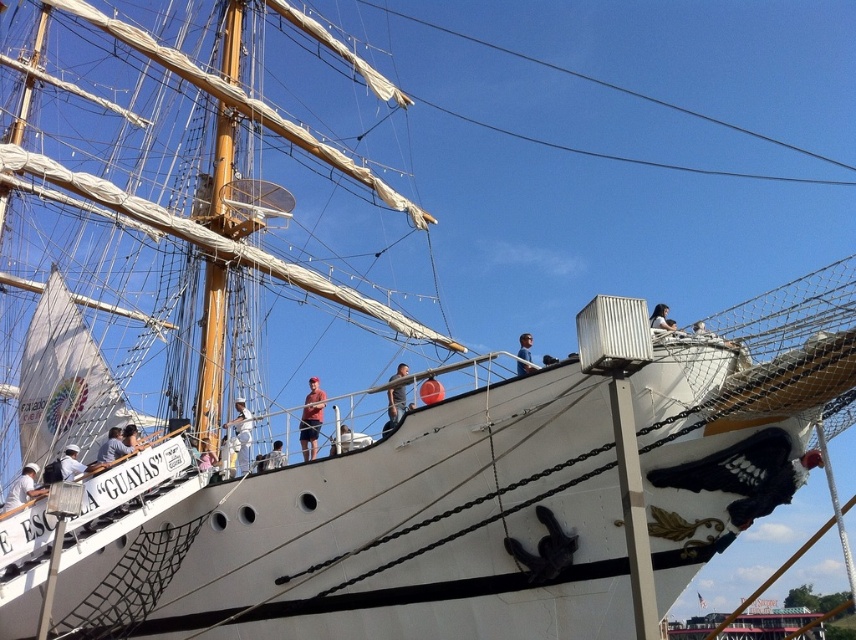
Question: Among these objects, which one is nearest to the camera?

Choices:
 (A) white matte shirt at upper left
 (B) gray fabric shirt at center
 (C) white fabric shirt at center

Answer: (B)

Question: Can you confirm if white matte sailor at lower left is thinner than white matte shirt at upper center?

Choices:
 (A) yes
 (B) no

Answer: (B)

Question: Which point appears farthest from the camera in this image?

Choices:
 (A) (528, 340)
 (B) (278, 440)
 (C) (241, 406)

Answer: (B)

Question: Which of these objects is positioned farthest from the gray fabric shirt at center?

Choices:
 (A) white matte shirt at center
 (B) matte red helmet at upper center

Answer: (A)

Question: Can you confirm if white matte shirt at upper left is bigger than gray fabric shirt at center?

Choices:
 (A) yes
 (B) no

Answer: (B)

Question: Does wooden/matte mast at center come behind gray fabric shirt at center?

Choices:
 (A) no
 (B) yes

Answer: (B)